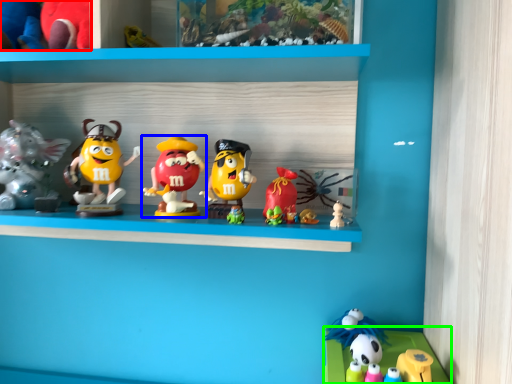
Question: Based on their relative distances, which object is nearer to toy (highlighted by a red box)? Choose from toy (highlighted by a blue box) and shelf (highlighted by a green box).

Choices:
 (A) toy
 (B) shelf

Answer: (A)